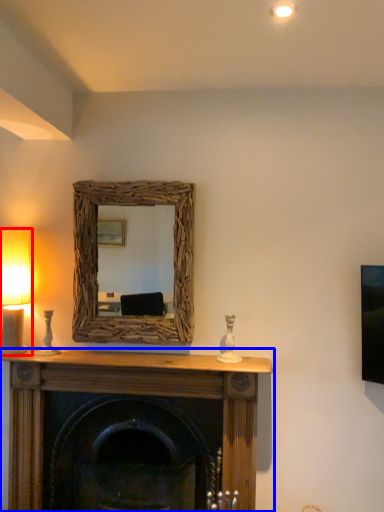
Question: Which of the following is the farthest to the observer, table lamp (highlighted by a red box) or fireplace (highlighted by a blue box)?

Choices:
 (A) table lamp
 (B) fireplace

Answer: (A)